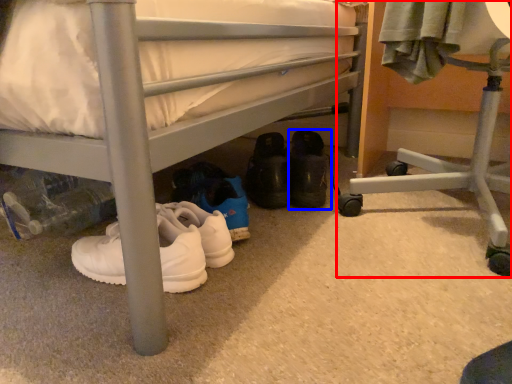
Question: Which object appears closest to the camera in this image, furniture (highlighted by a red box) or footwear (highlighted by a blue box)?

Choices:
 (A) furniture
 (B) footwear

Answer: (A)